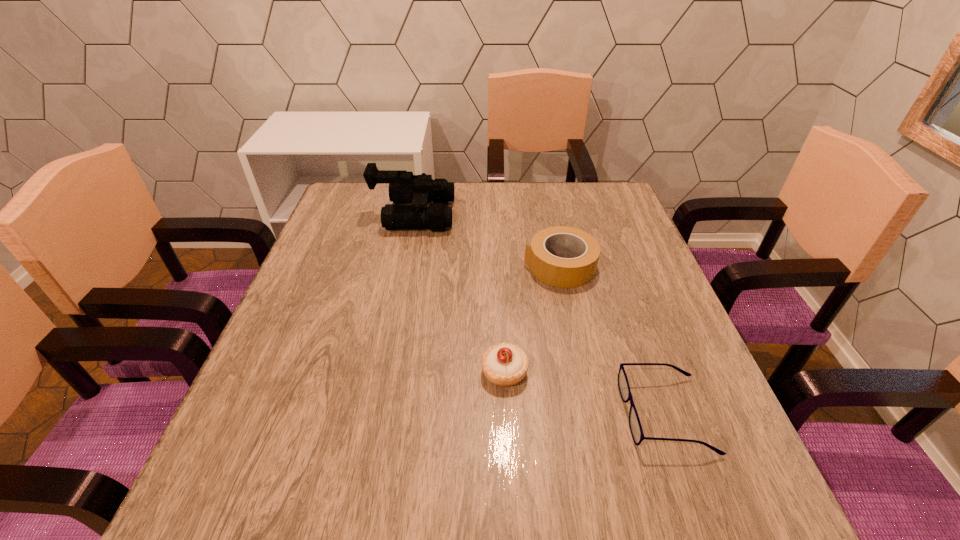
Image resolution: width=960 pixels, height=540 pixels. Identify the location of vacant region at the left edge of the desktop. (324, 387).

In the image, there is a desktop. Where is `blank space at the right edge`? blank space at the right edge is located at coordinates (628, 349).

This screenshot has width=960, height=540. I want to click on vacant area at the far left corner, so click(x=359, y=202).

Locate an element on the screen. free point at the near left corner is located at coordinates (224, 535).

Where is `free space at the near right corner`? The width and height of the screenshot is (960, 540). free space at the near right corner is located at coordinates (673, 495).

Image resolution: width=960 pixels, height=540 pixels. I want to click on free spot between the tallest object and the duct tape, so click(x=487, y=240).

Locate an element on the screen. The width and height of the screenshot is (960, 540). free spot between the second farthest object and the third object from right to left is located at coordinates (532, 319).

You are a GUI agent. You are given a task and a screenshot of the screen. Output one action in this format:
    pyautogui.click(x=<x>, y=<y>)
    Task: Click on the vacant area that lies between the leftmost object and the second farthest object
    This screenshot has width=960, height=540.
    Given the screenshot: What is the action you would take?
    (487, 240)

Find the location of `free spot between the leftmost object and the duct tape`. free spot between the leftmost object and the duct tape is located at coordinates (487, 240).

Image resolution: width=960 pixels, height=540 pixels. What are the coordinates of `free point between the duct tape and the shortest object` in the screenshot? It's located at (612, 340).